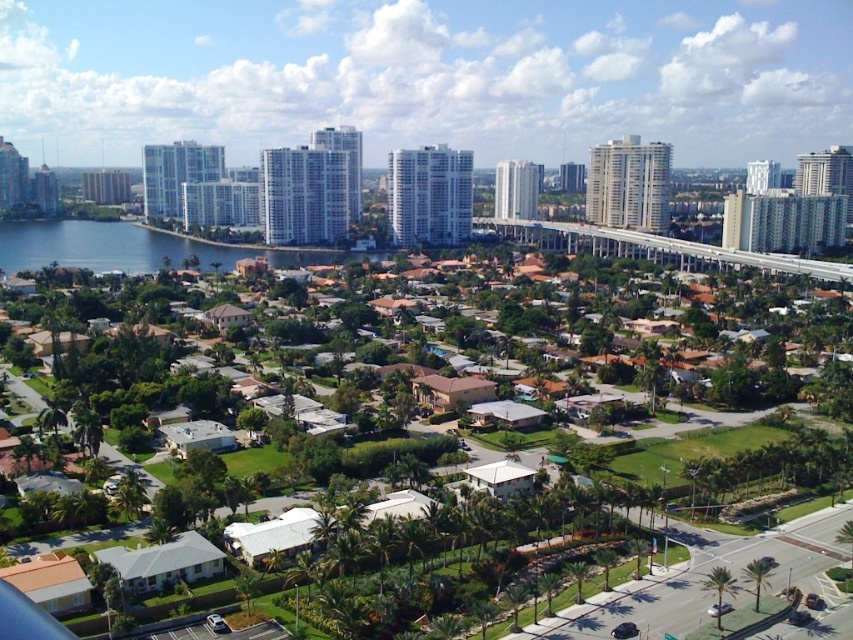
Question: Is green grass at center to the right of blue water at lower left from the viewer's perspective?

Choices:
 (A) no
 (B) yes

Answer: (B)

Question: Is green grass at center to the left of blue water at lower left from the viewer's perspective?

Choices:
 (A) no
 (B) yes

Answer: (A)

Question: Which point is closer to the camera taking this photo?

Choices:
 (A) (723, 392)
 (B) (16, 221)

Answer: (A)

Question: Can you confirm if green grass at center is thinner than blue water at lower left?

Choices:
 (A) yes
 (B) no

Answer: (B)

Question: Which object appears closest to the camera in this image?

Choices:
 (A) green grass at center
 (B) blue water at lower left

Answer: (A)